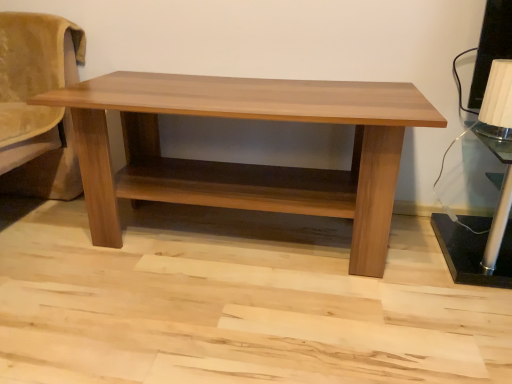
Question: Is black metallic table lamp at right, which appears as the 2th table lamp when viewed from the top, in front of or behind light brown wood table at center in the image?

Choices:
 (A) front
 (B) behind

Answer: (B)

Question: Considering the relative positions of black metallic table lamp at right, which appears as the 2th table lamp when viewed from the top, and light brown wood table at center in the image provided, is black metallic table lamp at right, which appears as the 2th table lamp when viewed from the top, to the left or to the right of light brown wood table at center?

Choices:
 (A) left
 (B) right

Answer: (B)

Question: Based on their relative distances, which object is farther from the black metallic table lamp at right, which appears as the 2th table lamp when viewed from the top?

Choices:
 (A) white textured lampshade at upper right, which ranks as the 2th table lamp in bottom-to-top order
 (B) light brown wood table at center

Answer: (B)

Question: Estimate the real-world distances between objects in this image. Which object is closer to the white textured lampshade at upper right, which ranks as the 2th table lamp in bottom-to-top order?

Choices:
 (A) light brown wood table at center
 (B) black metallic table lamp at right, the 1th table lamp in the bottom-to-top sequence

Answer: (B)